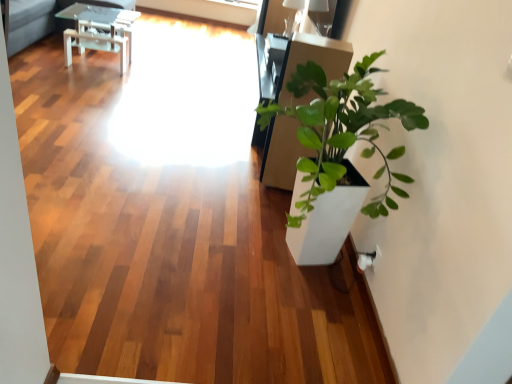
Question: Looking at their shapes, would you say white glossy table at upper left is wider or thinner than translucent glass window screen at upper center?

Choices:
 (A) wide
 (B) thin

Answer: (A)

Question: Is white glossy table at upper left inside the boundaries of translucent glass window screen at upper center, or outside?

Choices:
 (A) inside
 (B) outside

Answer: (B)

Question: Would you say white glossy table at upper left is to the left or to the right of translucent glass window screen at upper center in the picture?

Choices:
 (A) right
 (B) left

Answer: (B)

Question: In terms of width, does translucent glass window screen at upper center look wider or thinner when compared to white glossy table at upper left?

Choices:
 (A) wide
 (B) thin

Answer: (B)

Question: Relative to white glossy table at upper left, is translucent glass window screen at upper center in front or behind?

Choices:
 (A) front
 (B) behind

Answer: (B)

Question: Which is correct: translucent glass window screen at upper center is inside white glossy table at upper left, or outside of it?

Choices:
 (A) inside
 (B) outside

Answer: (B)

Question: In terms of size, does translucent glass window screen at upper center appear bigger or smaller than white glossy table at upper left?

Choices:
 (A) small
 (B) big

Answer: (A)